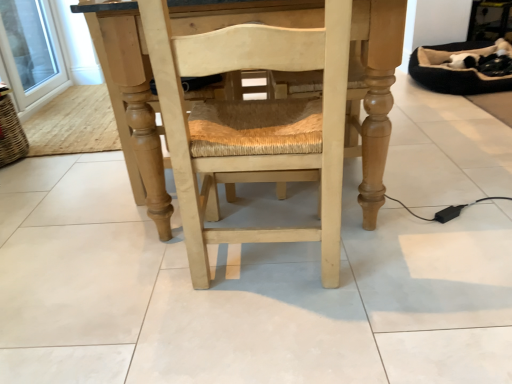
Question: From the image's perspective, relative to light wood chair at center, is transparent glass door at upper left above or below?

Choices:
 (A) above
 (B) below

Answer: (A)

Question: Is transparent glass door at upper left inside or outside of light wood chair at center?

Choices:
 (A) inside
 (B) outside

Answer: (B)

Question: Considering the positions of point (46, 9) and point (335, 206), is point (46, 9) closer or farther from the camera than point (335, 206)?

Choices:
 (A) farther
 (B) closer

Answer: (A)

Question: Considering the positions of light wood chair at center and transparent glass door at upper left in the image, is light wood chair at center taller or shorter than transparent glass door at upper left?

Choices:
 (A) short
 (B) tall

Answer: (B)

Question: Considering the relative positions of light wood chair at center and transparent glass door at upper left in the image provided, is light wood chair at center to the left or to the right of transparent glass door at upper left?

Choices:
 (A) right
 (B) left

Answer: (A)

Question: In the image, is light wood chair at center positioned in front of or behind transparent glass door at upper left?

Choices:
 (A) front
 (B) behind

Answer: (A)

Question: Considering the positions of light wood chair at center and transparent glass door at upper left in the image, is light wood chair at center bigger or smaller than transparent glass door at upper left?

Choices:
 (A) big
 (B) small

Answer: (A)